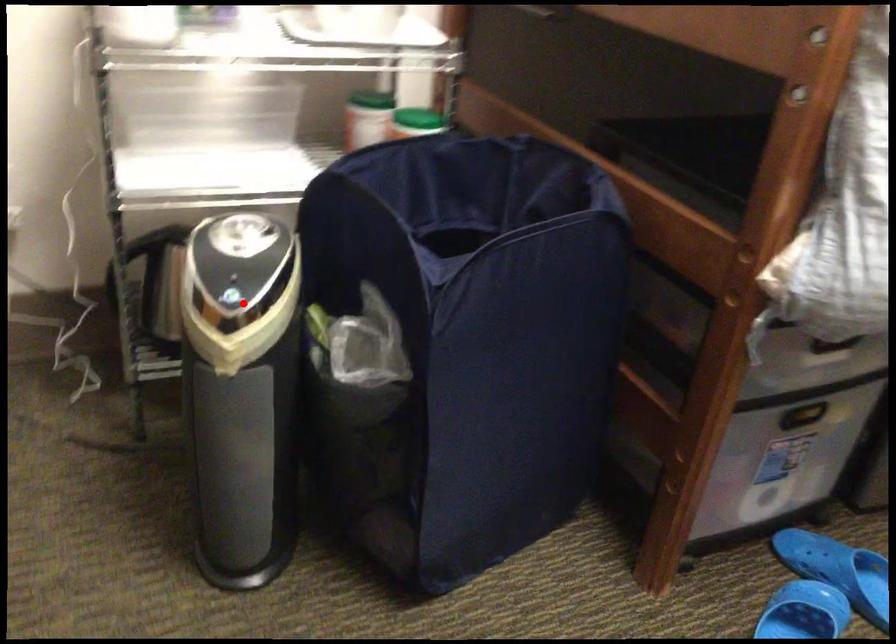
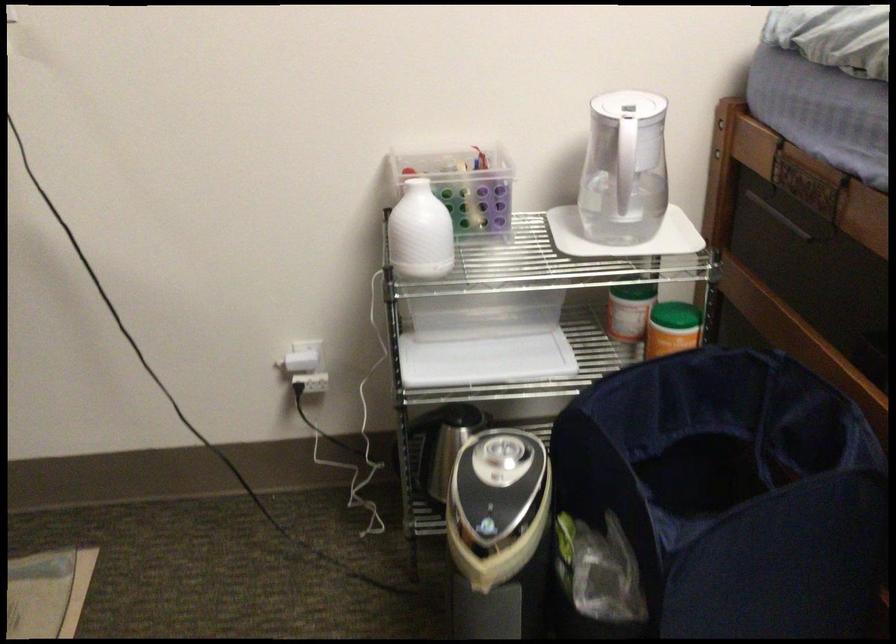
Question: I am providing you with two images of the same scene from different viewpoints. A red point is shown in image1. For the corresponding object point in image2, is it positioned nearer or farther from the camera?

Choices:
 (A) Nearer
 (B) Farther

Answer: (B)